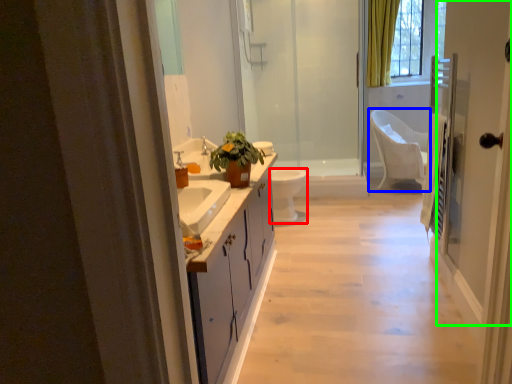
Question: Which object is positioned farthest from toilet (highlighted by a red box)? Select from chair (highlighted by a blue box) and screen door (highlighted by a green box).

Choices:
 (A) chair
 (B) screen door

Answer: (B)